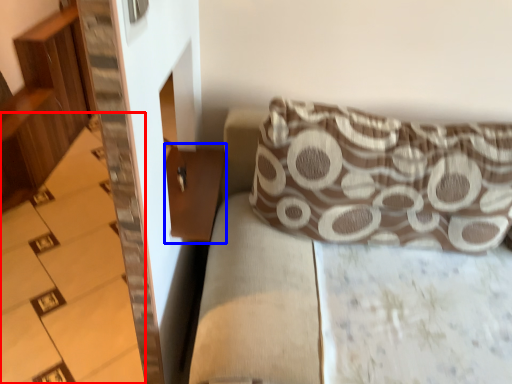
Question: Which object appears farthest to the camera in this image, stairwell (highlighted by a red box) or table (highlighted by a blue box)?

Choices:
 (A) stairwell
 (B) table

Answer: (A)